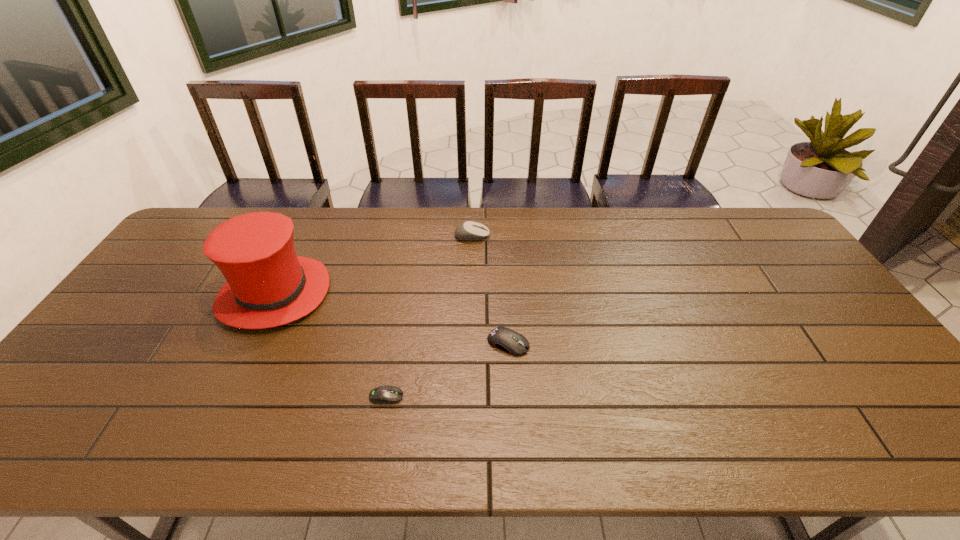
Identify the location of free point between the tallest object and the leftmost computer mouse. The width and height of the screenshot is (960, 540). pos(330,346).

Where is `free point between the second shortest object and the hat`? Image resolution: width=960 pixels, height=540 pixels. free point between the second shortest object and the hat is located at coordinates (391, 319).

Image resolution: width=960 pixels, height=540 pixels. What are the coordinates of `vacant region between the second farthest computer mouse and the hat` in the screenshot? It's located at (391, 319).

At what (x,y) coordinates should I click in order to perform the action: click on free space between the leftmost computer mouse and the second shortest object. Please return your answer as a coordinate pair (x, y). Looking at the image, I should click on (447, 370).

The width and height of the screenshot is (960, 540). Find the location of `free space between the third tallest object and the tallest object`. free space between the third tallest object and the tallest object is located at coordinates (391, 319).

Identify the location of free space between the leftmost object and the third shortest object. (373, 265).

Identify the location of free space between the tallest object and the third tallest object. Image resolution: width=960 pixels, height=540 pixels. (391, 319).

Identify the location of vacant area between the third tallest object and the tallest computer mouse. (491, 289).

Identify which object is located as the third nearest to the shortest computer mouse. Please provide its 2D coordinates. Your answer should be formatted as a tuple, i.e. [(x, y)], where the tuple contains the x and y coordinates of a point satisfying the conditions above.

[(467, 231)]

The image size is (960, 540). What are the coordinates of `the second closest object relative to the farthest object` in the screenshot? It's located at (508, 340).